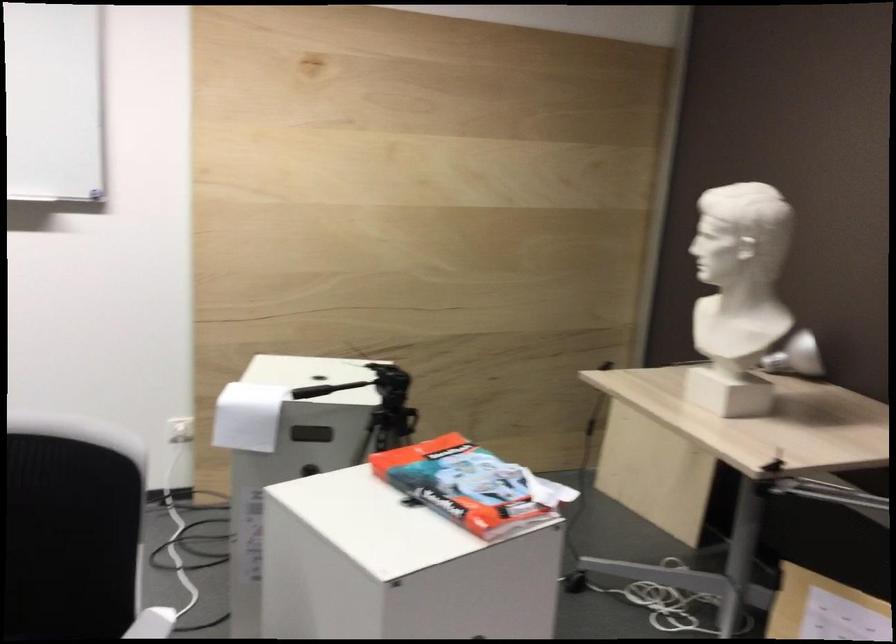
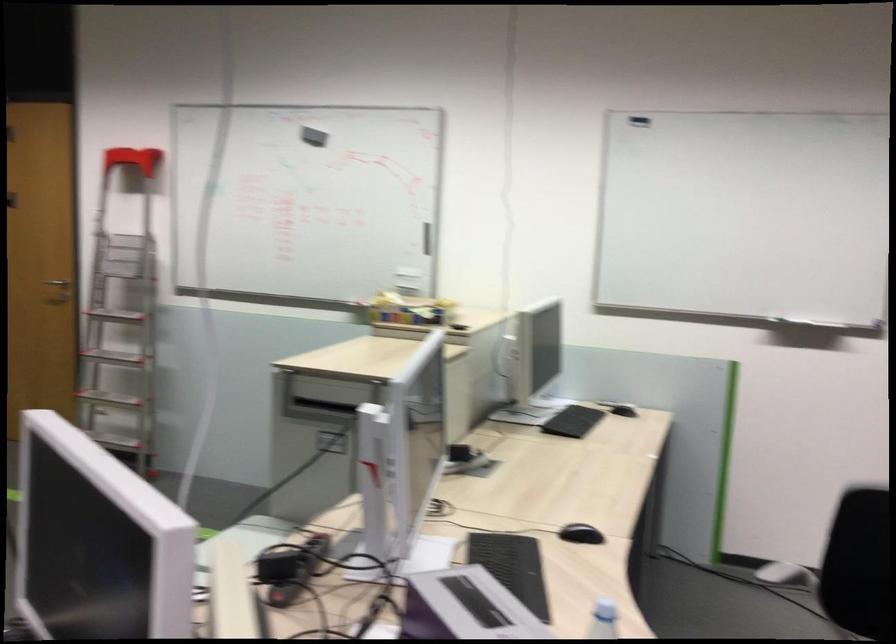
Question: The first image is from the beginning of the video and the second image is from the end. How did the camera likely rotate when shooting the video?

Choices:
 (A) Left
 (B) Right
 (C) Up
 (D) Down

Answer: (A)